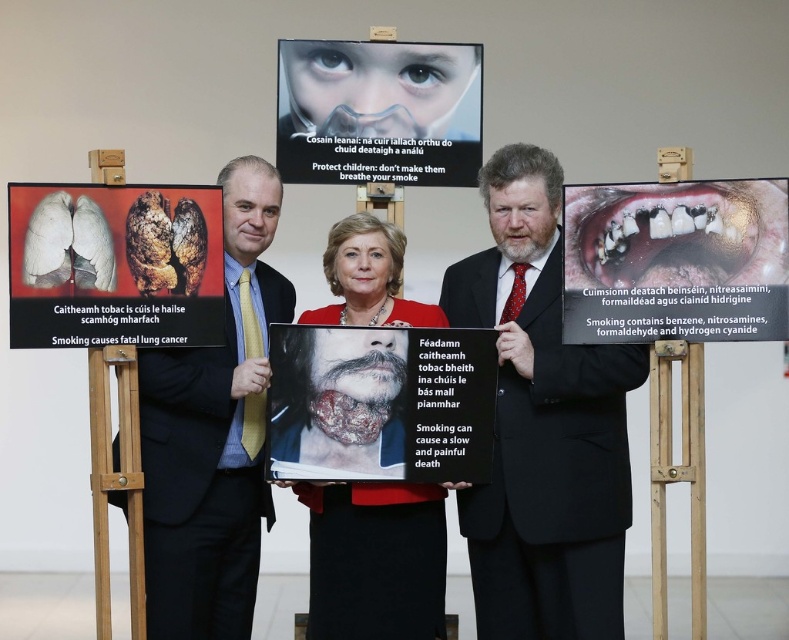
You are a photographer standing 10 feet away from the yellowish dentin tooth at center and the matte plastic mask at upper center. You need to take a photo that captures both objects in the frame. Given their distance from each other, will you be able to fit both into the camera frame without moving closer or zooming out?

The yellowish dentin tooth at center is 4.72 feet away from the matte plastic mask at upper center. Since you are 10 feet away from both objects, the distance between them is less than half your distance from them. This means they are close enough to each other relative to your position to fit within a standard camera frame without needing to zoom out or move closer.

Where is the yellowish dentin tooth at center located in the image?

The yellowish dentin tooth at center is located at point (x=675, y=260) in the image.